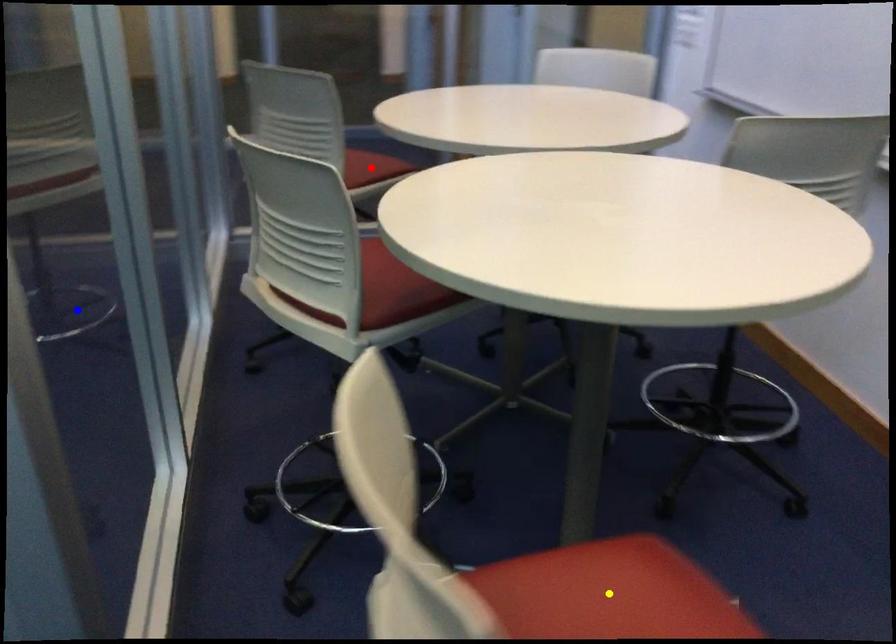
Order these from farthest to nearest:
blue point, yellow point, red point

1. blue point
2. red point
3. yellow point